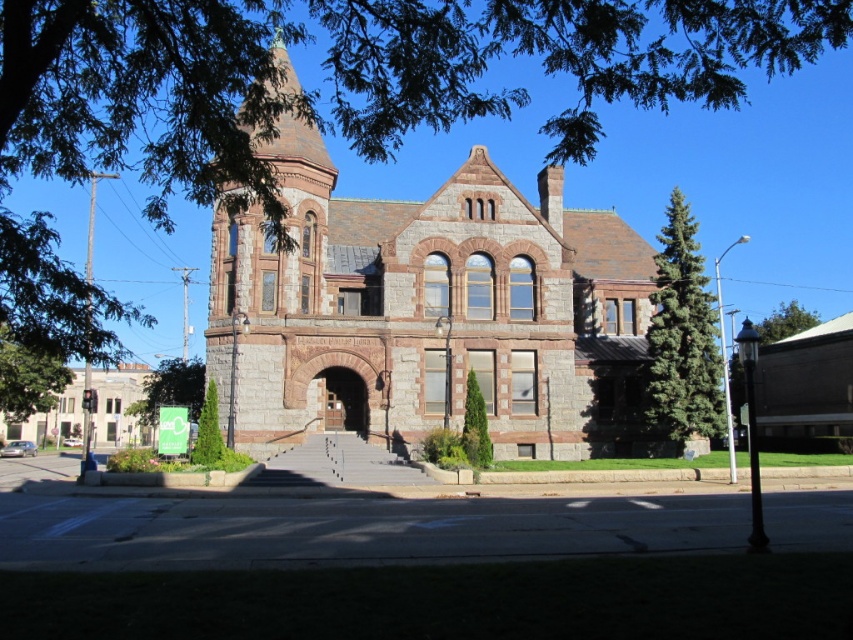
You are standing at the base of the steps leading to the historic building. You notice two trees in the scene. Which tree, the green fir tree at right or the green textured tree at center, is taller?

The green fir tree at right is taller than the green textured tree at center.

You are standing at the entrance of the historic stone building and want to find the tallest tree in the area. Which tree should you look towards, the green leafy tree at lower left or the green textured tree at center?

The green textured tree at center is taller than the green leafy tree at lower left, so you should look towards the green textured tree at center.